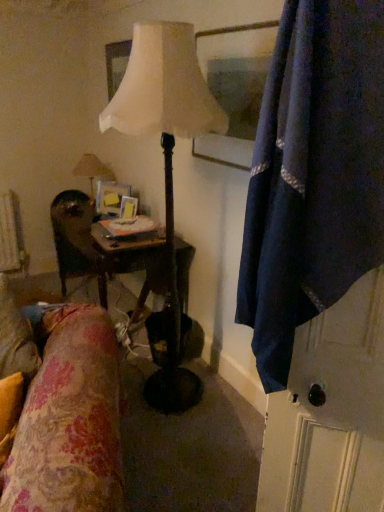
Question: From the image's perspective, would you say matte white lamp at center, positioned as the 2th lamp in left-to-right order, is shown under matte beige lamp at upper left, which is the 1th lamp in left-to-right order?

Choices:
 (A) yes
 (B) no

Answer: (A)

Question: From a real-world perspective, is matte white lamp at center, positioned as the 2th lamp in left-to-right order, positioned under matte beige lamp at upper left, which is the 1th lamp in left-to-right order, based on gravity?

Choices:
 (A) no
 (B) yes

Answer: (B)

Question: Can you confirm if matte white lamp at center, marked as the 1th lamp in a right-to-left arrangement, is positioned to the left of matte beige lamp at upper left, which is the 1th lamp in left-to-right order?

Choices:
 (A) yes
 (B) no

Answer: (B)

Question: From the image's perspective, is matte white lamp at center, marked as the 1th lamp in a right-to-left arrangement, above matte beige lamp at upper left, which is the first lamp from back to front?

Choices:
 (A) no
 (B) yes

Answer: (A)

Question: Is matte white lamp at center, positioned as the 2th lamp in left-to-right order, far from matte beige lamp at upper left, which is the 1th lamp in left-to-right order?

Choices:
 (A) yes
 (B) no

Answer: (A)

Question: Can matte beige lamp at upper left, placed as the second lamp when sorted from right to left, be found inside matte white lamp at center, positioned as the 2th lamp in left-to-right order?

Choices:
 (A) no
 (B) yes

Answer: (A)

Question: Could floral fabric at lower left be considered to be inside matte beige lamp at upper left, which is the 1th lamp in left-to-right order?

Choices:
 (A) yes
 (B) no

Answer: (B)

Question: Does matte beige lamp at upper left, which is the first lamp from back to front, appear on the right side of floral fabric at lower left?

Choices:
 (A) yes
 (B) no

Answer: (B)

Question: From a real-world perspective, is matte beige lamp at upper left, which is the first lamp from back to front, physically below floral fabric at lower left?

Choices:
 (A) no
 (B) yes

Answer: (A)

Question: Can you confirm if matte beige lamp at upper left, which is the 1th lamp in left-to-right order, is taller than floral fabric at lower left?

Choices:
 (A) yes
 (B) no

Answer: (B)

Question: Does matte beige lamp at upper left, placed as the second lamp when sorted from right to left, have a lesser height compared to floral fabric at lower left?

Choices:
 (A) no
 (B) yes

Answer: (B)

Question: Is matte beige lamp at upper left, which is the first lamp from back to front, turned away from floral fabric at lower left?

Choices:
 (A) no
 (B) yes

Answer: (A)

Question: Is the position of wooden glossy picture frame at center more distant than that of matte white lamp at center, arranged as the first lamp when viewed from the front?

Choices:
 (A) no
 (B) yes

Answer: (B)